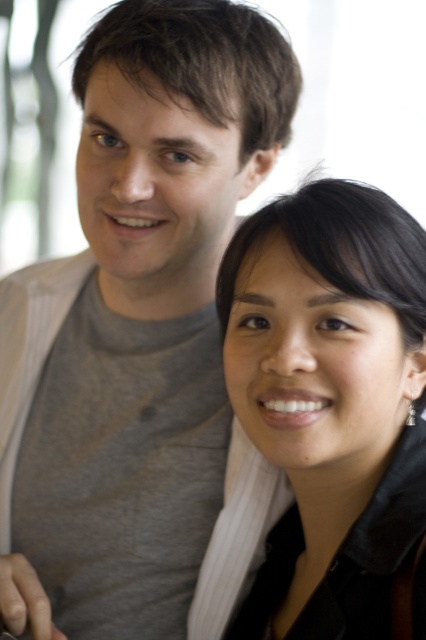
Question: In this image, where is gray cotton t-shirt at upper left located relative to black leather jacket at center?

Choices:
 (A) left
 (B) right

Answer: (A)

Question: Which object is closer to the camera taking this photo?

Choices:
 (A) black leather jacket at center
 (B) gray cotton t-shirt at upper left

Answer: (A)

Question: Does gray cotton t-shirt at upper left have a lesser width compared to black leather jacket at center?

Choices:
 (A) yes
 (B) no

Answer: (B)

Question: Can you confirm if gray cotton t-shirt at upper left is wider than black leather jacket at center?

Choices:
 (A) no
 (B) yes

Answer: (B)

Question: Which point appears farthest from the camera in this image?

Choices:
 (A) (322, 500)
 (B) (34, 410)

Answer: (B)

Question: Among these objects, which one is farthest from the camera?

Choices:
 (A) gray cotton t-shirt at upper left
 (B) black leather jacket at center

Answer: (A)